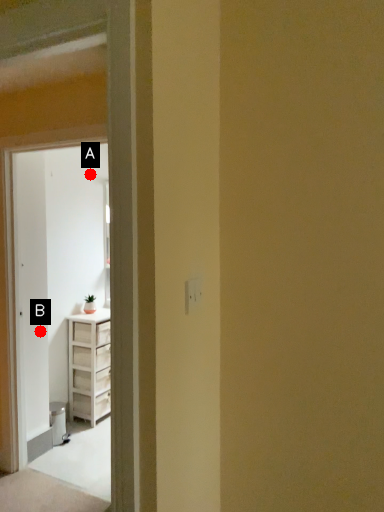
Question: Two points are circled on the image, labeled by A and B beside each circle. Which point is closer to the camera?

Choices:
 (A) A is closer
 (B) B is closer

Answer: (B)